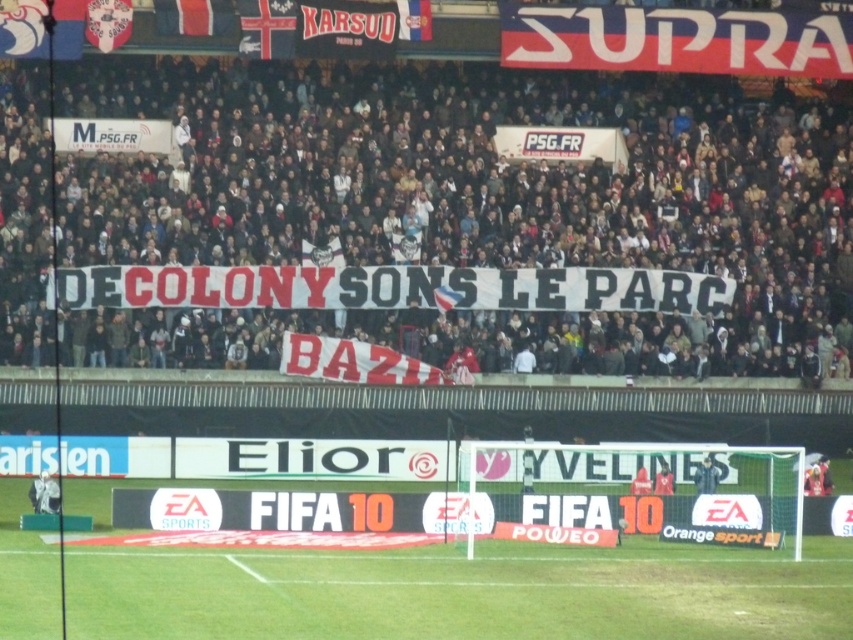
Question: Is white fabric banner at center positioned in front of green grass at lower center?

Choices:
 (A) no
 (B) yes

Answer: (A)

Question: Among these points, which one is farthest from the camera?

Choices:
 (A) (335, 316)
 (B) (624, 573)

Answer: (A)

Question: Does white fabric banner at center have a larger size compared to green grass at lower center?

Choices:
 (A) no
 (B) yes

Answer: (B)

Question: Among these points, which one is nearest to the camera?

Choices:
 (A) (265, 355)
 (B) (634, 628)

Answer: (B)

Question: Is the position of white fabric banner at center more distant than that of green grass at lower center?

Choices:
 (A) yes
 (B) no

Answer: (A)